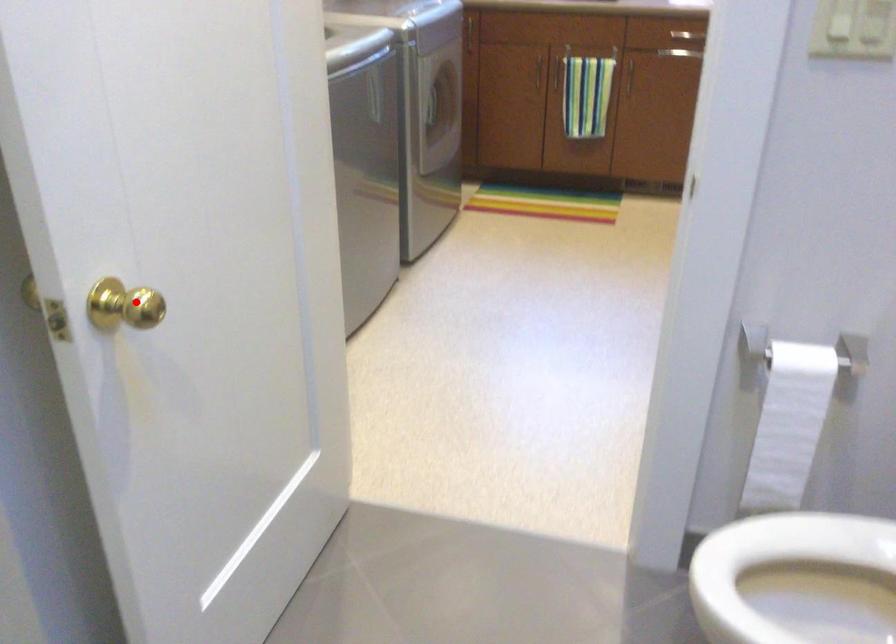
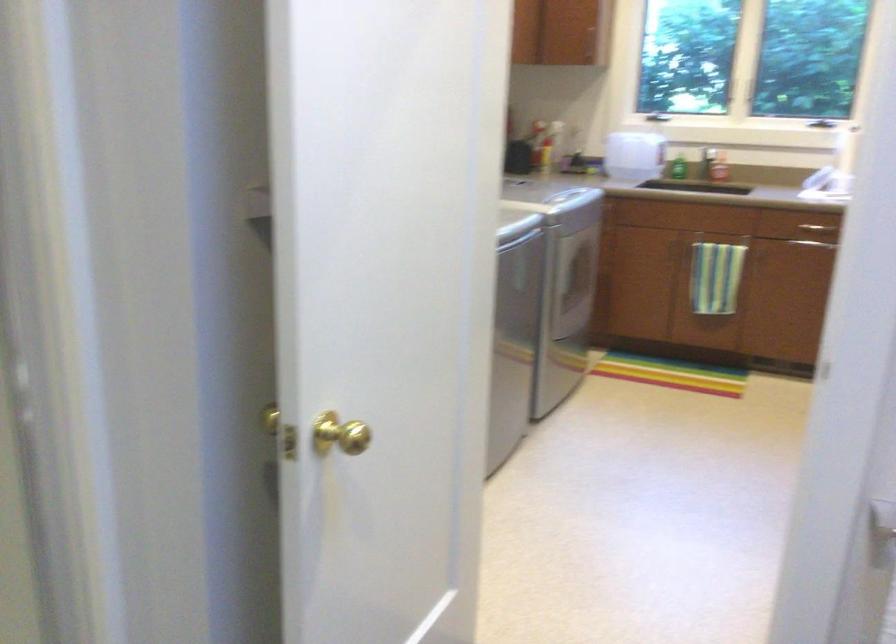
Question: A red point is marked in image1. In image2, is the corresponding 3D point closer to the camera or farther? Reply with the corresponding letter.

Choices:
 (A) The corresponding 3D point is closer.
 (B) The corresponding 3D point is farther.

Answer: (B)